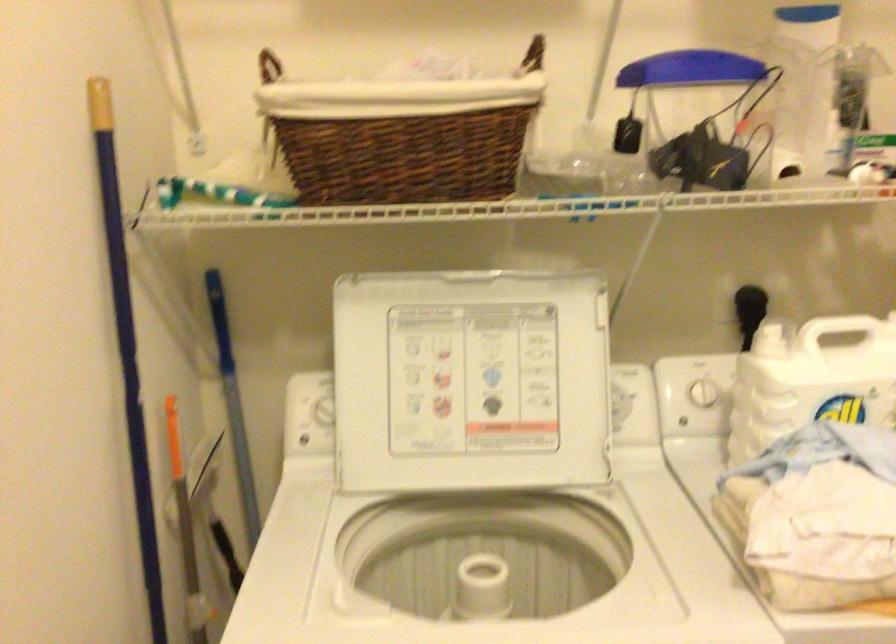
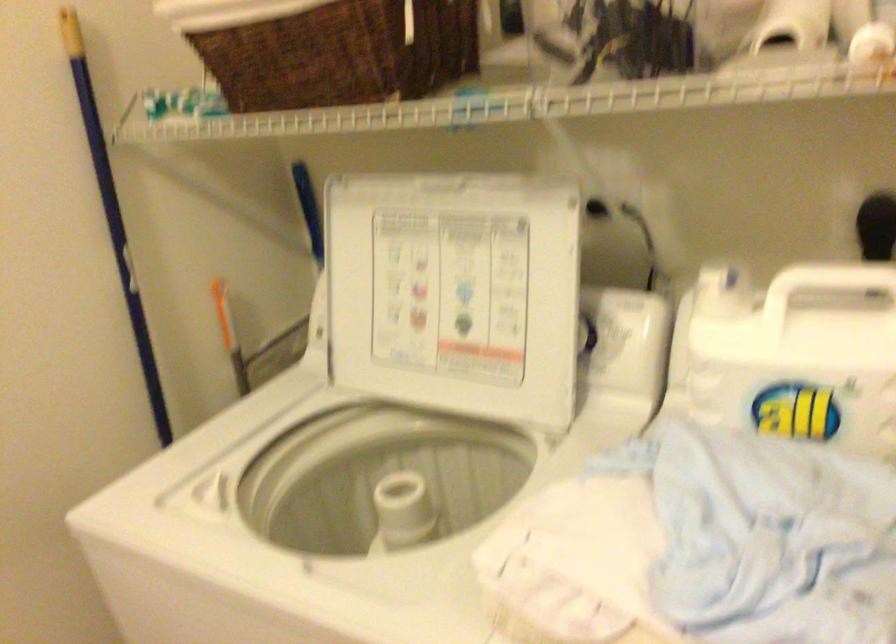
Where in the second image is the point corresponding to point 479,379 from the first image?

(454, 292)